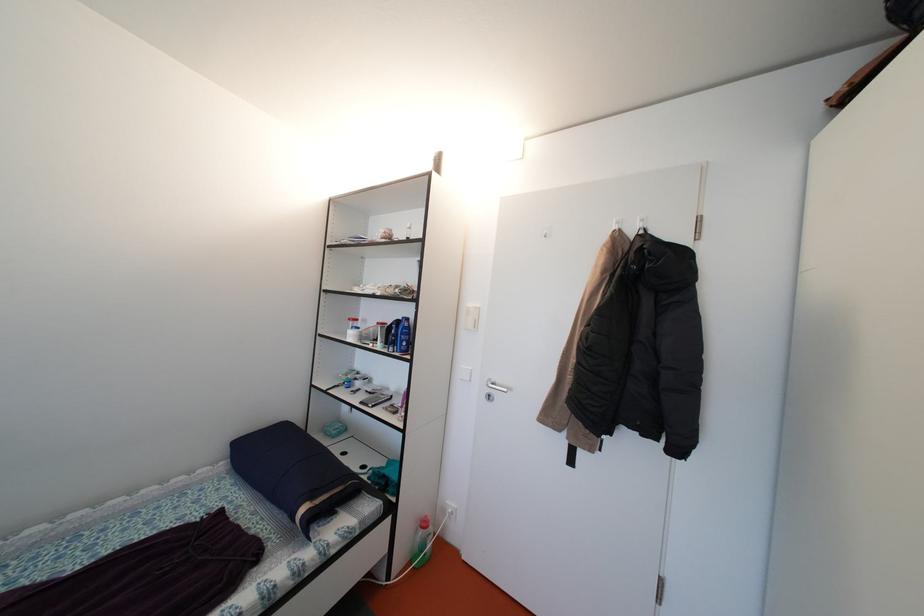
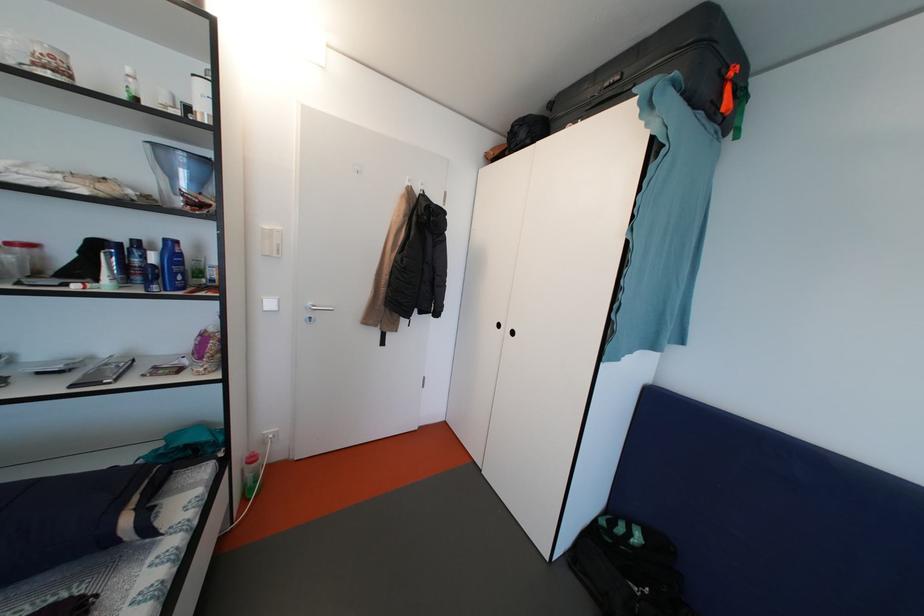
The images are taken continuously from a first-person perspective. In which direction is your viewpoint rotating?

The camera rotated toward right-down.